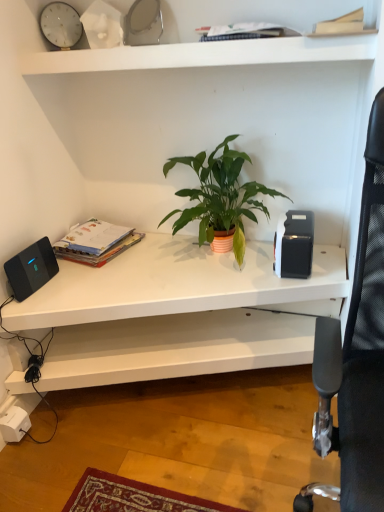
I want to click on vacant area to the left of green matte plant at center, so click(107, 280).